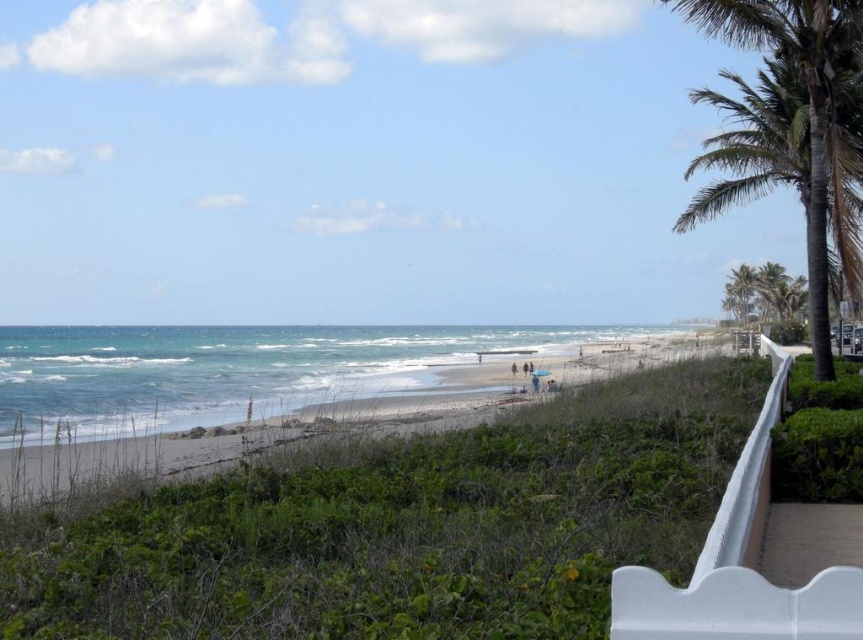
You are a photographer standing at the white railing on the right side of the beach scene. You want to capture a wide shot that includes both the sandy beach at center and the green leafy palm tree at right. Given that your camera can focus on objects up to 50 meters away, will you be able to include both in the same frame without moving closer?

The distance between the sandy beach at center and the green leafy palm tree at right is 53.91 meters. Since your camera can only focus up to 50 meters, you won t be able to include both in the same frame without moving closer.

You are planning to build a small sandcastle on the sandy beach at center. Considering the space available, will there be enough room to construct it without being too close to the green leafy palm tree at right?

The sandy beach at center has a larger width than the green leafy palm tree at right, so there should be sufficient space to build the sandcastle away from the tree.